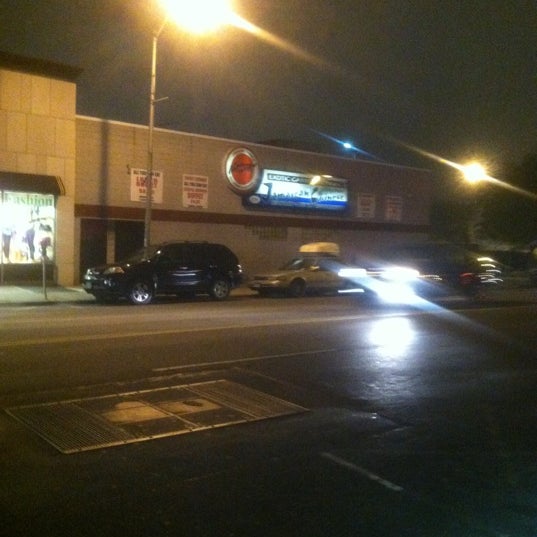
In order to click on yellow light in this screenshot , I will do `click(203, 17)`, `click(475, 172)`.